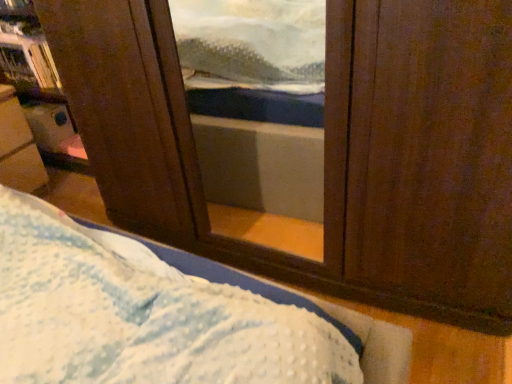
Question: In the image, is wooden bookshelf at upper left on the left side or the right side of metallic silver tray at left?

Choices:
 (A) right
 (B) left

Answer: (A)

Question: Relative to metallic silver tray at left, is wooden bookshelf at upper left in front or behind?

Choices:
 (A) behind
 (B) front

Answer: (A)

Question: From a real-world perspective, is wooden bookshelf at upper left physically located above or below metallic silver tray at left?

Choices:
 (A) below
 (B) above

Answer: (B)

Question: Would you say metallic silver tray at left is to the left or to the right of wooden bookshelf at upper left in the picture?

Choices:
 (A) left
 (B) right

Answer: (A)

Question: Considering the positions of metallic silver tray at left and wooden bookshelf at upper left in the image, is metallic silver tray at left wider or thinner than wooden bookshelf at upper left?

Choices:
 (A) wide
 (B) thin

Answer: (A)

Question: Do you think metallic silver tray at left is within wooden bookshelf at upper left, or outside of it?

Choices:
 (A) inside
 (B) outside

Answer: (B)

Question: Based on their sizes in the image, would you say metallic silver tray at left is bigger or smaller than wooden bookshelf at upper left?

Choices:
 (A) big
 (B) small

Answer: (A)